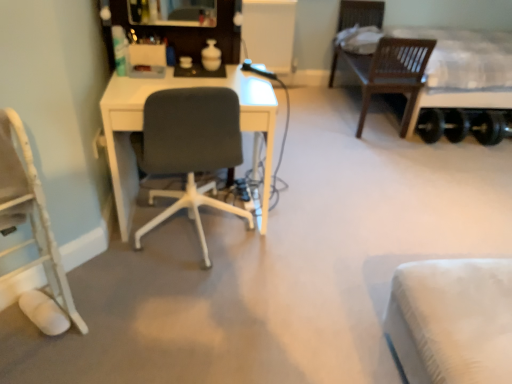
Question: Can you confirm if white fabric chair at lower left, positioned as the 1th chair in left-to-right order, is bigger than wooden bed at right?

Choices:
 (A) no
 (B) yes

Answer: (A)

Question: From the image's perspective, would you say white fabric chair at lower left, the 2th chair when ordered from right to left, is shown under wooden bed at right?

Choices:
 (A) no
 (B) yes

Answer: (B)

Question: Is wooden bed at right completely or partially inside white fabric chair at lower left, the 2th chair when ordered from right to left?

Choices:
 (A) yes
 (B) no

Answer: (B)

Question: Is white fabric chair at lower left, positioned as the 1th chair in left-to-right order, outside wooden bed at right?

Choices:
 (A) yes
 (B) no

Answer: (A)

Question: Can you see white fabric chair at lower left, the 2th chair when ordered from right to left, touching wooden bed at right?

Choices:
 (A) yes
 (B) no

Answer: (B)

Question: Does white fabric chair at lower left, the 2th chair when ordered from right to left, have a smaller size compared to wooden bed at right?

Choices:
 (A) yes
 (B) no

Answer: (A)

Question: Does wooden bed at right contain matte gray chair at center, which is the 1th chair from right to left?

Choices:
 (A) yes
 (B) no

Answer: (B)

Question: Can you confirm if wooden bed at right is bigger than matte gray chair at center, which is the 1th chair from right to left?

Choices:
 (A) no
 (B) yes

Answer: (B)

Question: Does wooden bed at right appear on the left side of matte gray chair at center, which is the 1th chair from right to left?

Choices:
 (A) no
 (B) yes

Answer: (A)

Question: From the image's perspective, is wooden bed at right under matte gray chair at center, which is the 1th chair from right to left?

Choices:
 (A) no
 (B) yes

Answer: (A)

Question: Does wooden bed at right have a greater height compared to matte gray chair at center, acting as the second chair starting from the left?

Choices:
 (A) no
 (B) yes

Answer: (B)

Question: Is matte gray chair at center, which is the 1th chair from right to left, at the back of wooden bed at right?

Choices:
 (A) yes
 (B) no

Answer: (B)

Question: Is wooden bed at right completely or partially outside of white fabric chair at lower left, the 2th chair when ordered from right to left?

Choices:
 (A) yes
 (B) no

Answer: (A)